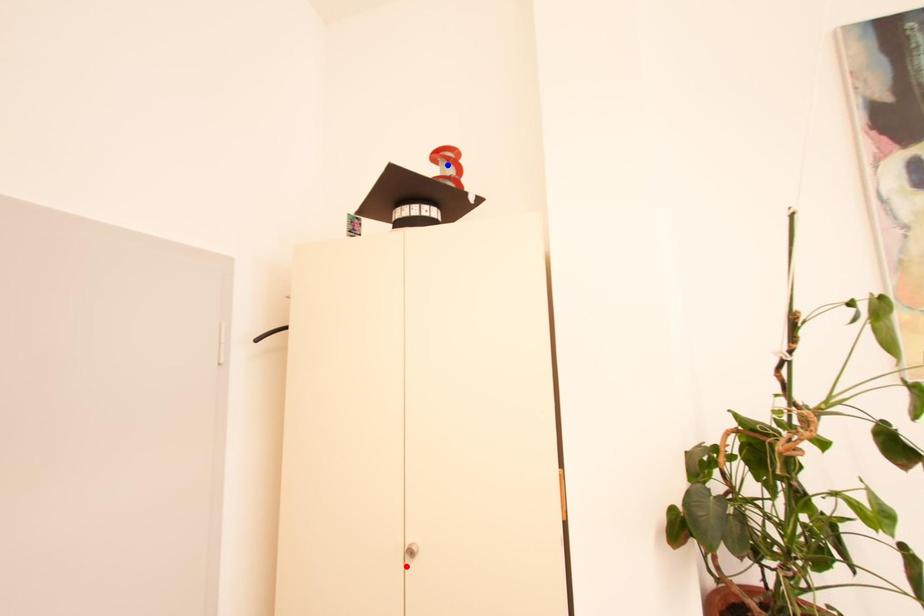
Question: Two points are marked on the image. Which point is closer to the camera?

Choices:
 (A) Blue point is closer.
 (B) Red point is closer.

Answer: (B)